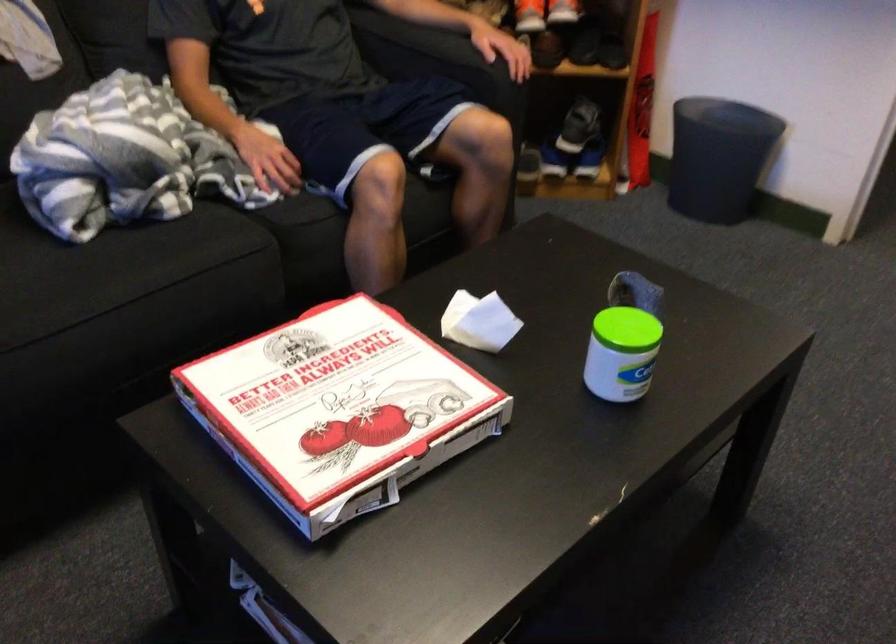
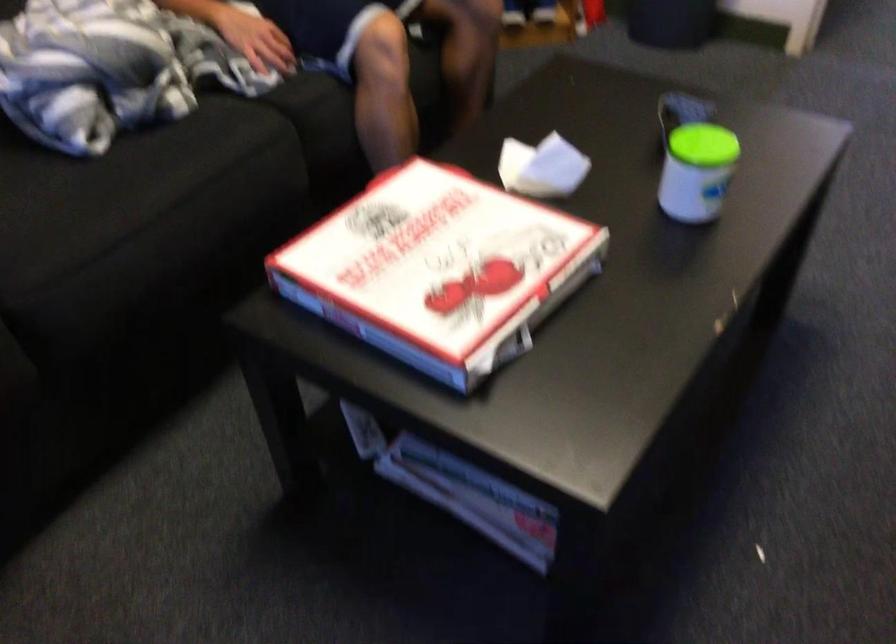
Question: How did the camera likely rotate?

Choices:
 (A) Left
 (B) Right
 (C) Up
 (D) Down

Answer: (D)